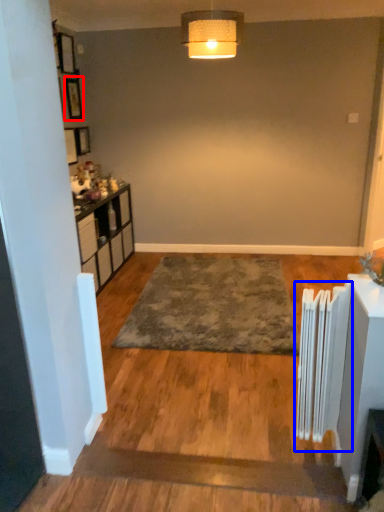
Question: Which object appears closest to the camera in this image, picture frame (highlighted by a red box) or radiator (highlighted by a blue box)?

Choices:
 (A) picture frame
 (B) radiator

Answer: (B)